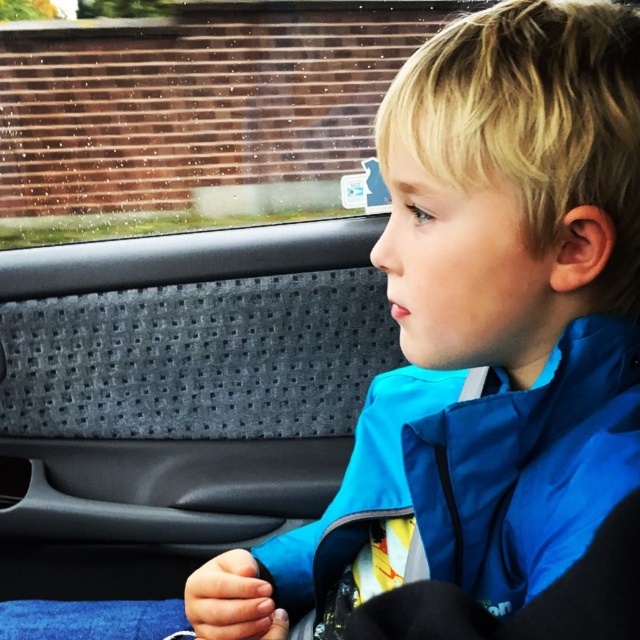
You are a passenger in the car and want to see the outside view better. Which object between the transparent glass window at upper left and the blue fabric jacket at center is closer to you?

The transparent glass window at upper left is closer to you than the blue fabric jacket at center because it is further to the viewer.

You are a passenger in the car and want to see the outside view clearly. The transparent glass window at upper left and the blue fabric jacket at center are in your line of sight. Which object is taller and might block your view?

The transparent glass window at upper left is much taller than the blue fabric jacket at center, so it might block your view more.

You are a passenger in the car and want to check the weather outside using the transparent glass window at upper left and the blue fabric jacket at center. Which object would allow you to see the outside clearly?

The transparent glass window at upper left has a larger size compared to blue fabric jacket at center, so you can see the outside clearly through the transparent glass window at upper left.